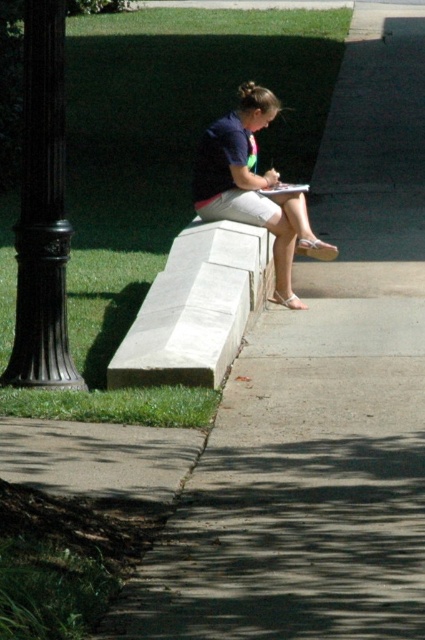
Question: Does white stone bench at center have a lesser width compared to matte blue shirt at center?

Choices:
 (A) no
 (B) yes

Answer: (B)

Question: Which point is farther from the camera taking this photo?

Choices:
 (A) (232, 225)
 (B) (197, 196)

Answer: (A)

Question: Which object is closer to the camera taking this photo?

Choices:
 (A) matte blue shirt at center
 (B) white stone bench at center
 (C) black polished metal pole at left

Answer: (C)

Question: Which is farther from the white stone bench at center?

Choices:
 (A) black polished metal pole at left
 (B) matte blue shirt at center

Answer: (A)

Question: Does black polished metal pole at left have a greater width compared to matte blue shirt at center?

Choices:
 (A) no
 (B) yes

Answer: (A)

Question: Is black polished metal pole at left below white stone bench at center?

Choices:
 (A) no
 (B) yes

Answer: (A)